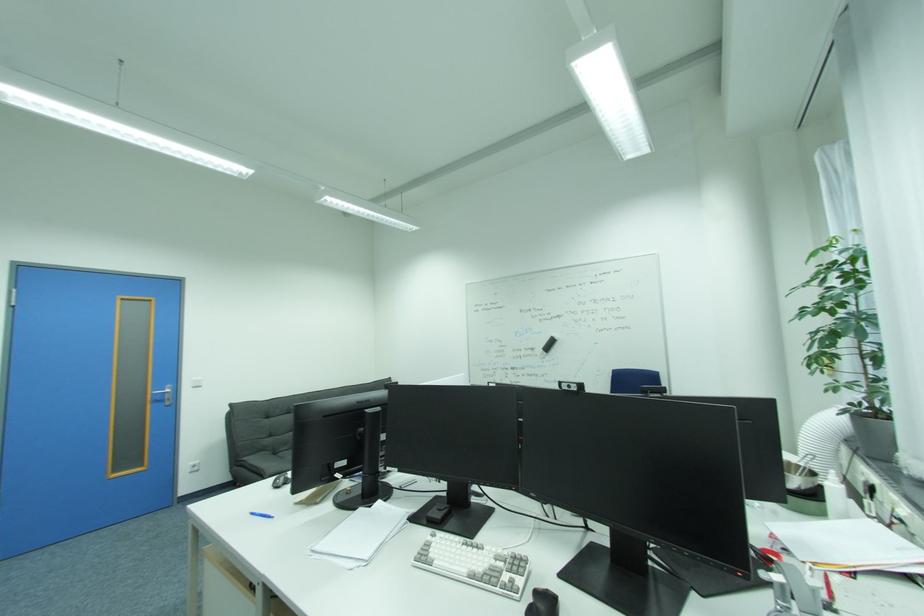
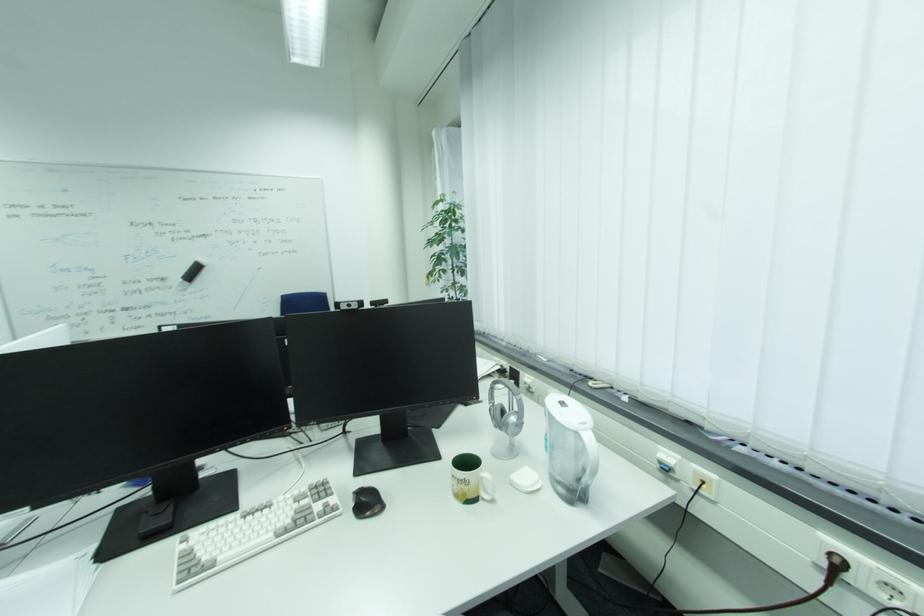
Find the pixel in the second image that matches [550,350] in the first image.

(189, 278)